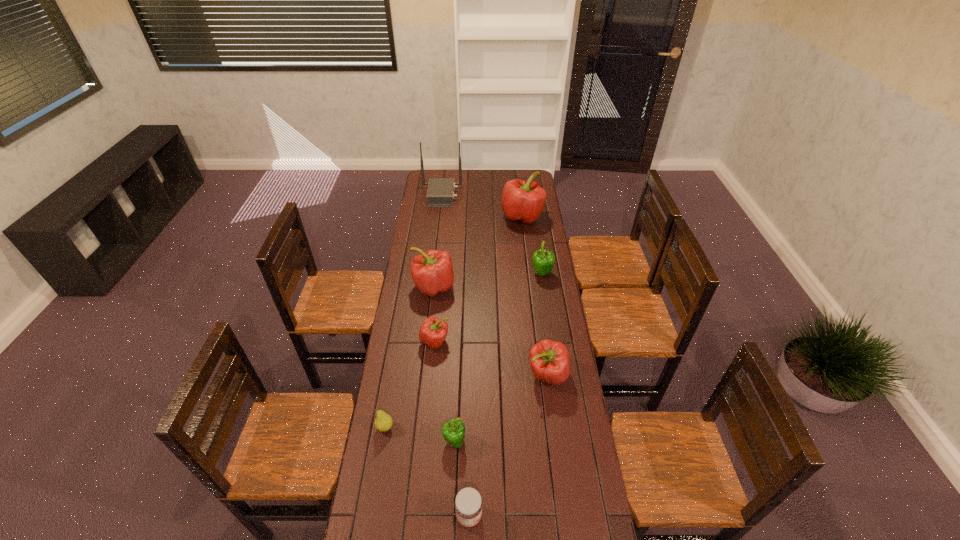
Where is `empty location between the smaller green bell pepper and the second farthest pink bell pepper`? empty location between the smaller green bell pepper and the second farthest pink bell pepper is located at coordinates (444, 364).

Identify the location of object that stands as the eighth closest to the right green bell pepper. This screenshot has width=960, height=540. (468, 504).

Locate an element on the screen. Image resolution: width=960 pixels, height=540 pixels. object that is the eighth closest to the nearest bell pepper is located at coordinates (440, 193).

Choose which bell pepper is the nearest neighbor to the second smallest pink bell pepper. Please provide its 2D coordinates. Your answer should be formatted as a tuple, i.e. [(x, y)], where the tuple contains the x and y coordinates of a point satisfying the conditions above.

[(453, 431)]

Find the location of `bell pepper that stands as the sixth closest to the nearest object`. bell pepper that stands as the sixth closest to the nearest object is located at coordinates [521, 200].

Choose which pink bell pepper is the second nearest neighbor to the fifth farthest object. Please provide its 2D coordinates. Your answer should be formatted as a tuple, i.e. [(x, y)], where the tuple contains the x and y coordinates of a point satisfying the conditions above.

[(550, 361)]

Identify the location of the second closest pink bell pepper to the tallest object. This screenshot has width=960, height=540. (432, 272).

Locate an element on the screen. free location that satisfies the following two spatial constraints: 1. on the back side of the right green bell pepper; 2. on the left side of the nearer green bell pepper is located at coordinates (462, 274).

Locate an element on the screen. This screenshot has height=540, width=960. free space that satisfies the following two spatial constraints: 1. on the back of the sixth farthest object to connect cables; 2. on the right side of the router is located at coordinates (420, 375).

Where is `vacant point that satisfies the following two spatial constraints: 1. on the back of the nearest bell pepper to connect cables; 2. on the right side of the router`? The height and width of the screenshot is (540, 960). vacant point that satisfies the following two spatial constraints: 1. on the back of the nearest bell pepper to connect cables; 2. on the right side of the router is located at coordinates (413, 442).